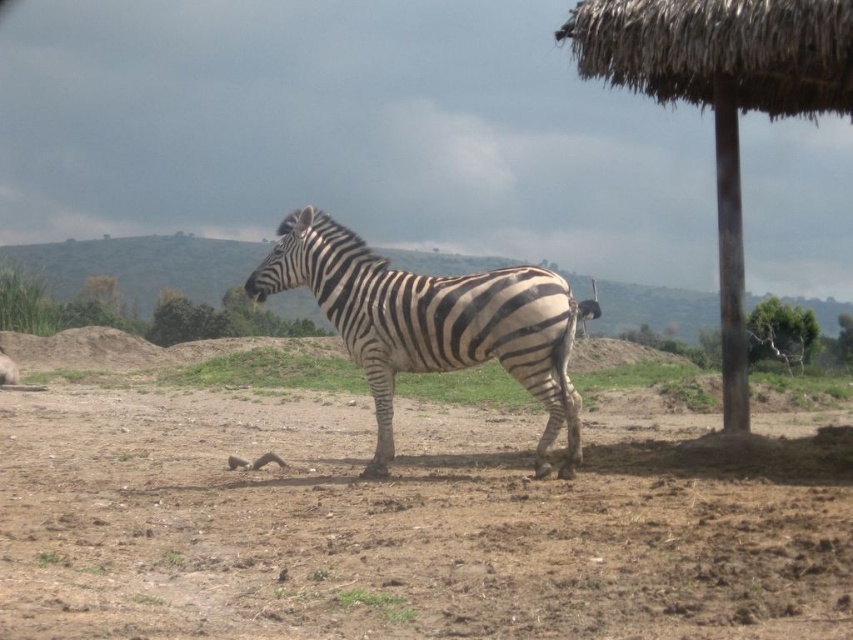
Is black and white striped zebra at center wider than green leafy tree at upper right?

No.

Who is positioned more to the left, black and white striped zebra at center or green leafy tree at upper right?

black and white striped zebra at center is more to the left.

Who is more distant from viewer, (554, 422) or (804, 348)?

Point (804, 348)

The image size is (853, 640). What are the coordinates of `black and white striped zebra at center` in the screenshot? It's located at (430, 323).

Can you confirm if black and white striped zebra at center is positioned to the right of brown wooden pole at right?

No, black and white striped zebra at center is not to the right of brown wooden pole at right.

Where is `black and white striped zebra at center`? Image resolution: width=853 pixels, height=640 pixels. black and white striped zebra at center is located at coordinates (430, 323).

Who is more distant from viewer, (515, 372) or (737, 387)?

Positioned behind is point (737, 387).

Locate an element on the screen. This screenshot has width=853, height=640. black and white striped zebra at center is located at coordinates (430, 323).

Between brown soil at center and brown wooden pole at right, which one appears on the left side from the viewer's perspective?

brown soil at center

Does brown soil at center have a lesser width compared to brown wooden pole at right?

Incorrect, brown soil at center's width is not less than brown wooden pole at right's.

Describe the element at coordinates (410, 522) in the screenshot. I see `brown soil at center` at that location.

Where is `brown soil at center`? This screenshot has height=640, width=853. brown soil at center is located at coordinates (410, 522).